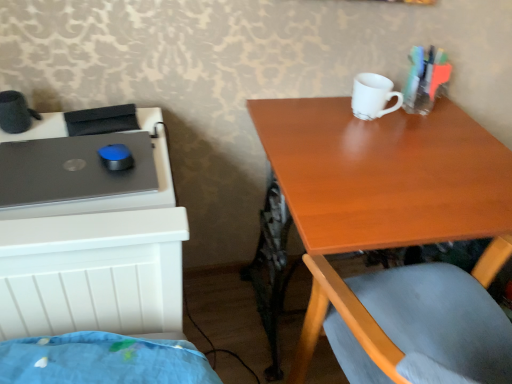
Where is `translucent plastic markers at upper right`? The height and width of the screenshot is (384, 512). translucent plastic markers at upper right is located at coordinates (425, 79).

Image resolution: width=512 pixels, height=384 pixels. What do you see at coordinates (72, 169) in the screenshot?
I see `matte black laptop at left` at bounding box center [72, 169].

What do you see at coordinates (384, 174) in the screenshot? I see `wooden table at upper right` at bounding box center [384, 174].

Identify the location of translucent plastic markers at upper right. (425, 79).

Is matte black laptop at left in contact with wooden table at upper right?

There is a gap between matte black laptop at left and wooden table at upper right.

From the image's perspective, is matte black laptop at left below wooden table at upper right?

No.

You are a GUI agent. You are given a task and a screenshot of the screen. Output one action in this format:
    pyautogui.click(x=<x>, y=<y>)
    Task: Click on the table that appears below the matte black laptop at left (from a real-world perspective)
    The height and width of the screenshot is (384, 512).
    Given the screenshot: What is the action you would take?
    pyautogui.click(x=384, y=174)

Between matte black laptop at left and wooden table at upper right, which one has less height?

matte black laptop at left is shorter.

Is wooden table at upper right closer to the viewer compared to matte black laptop at left?

No, it is not.

From a real-world perspective, is wooden table at upper right positioned over matte black laptop at left based on gravity?

Actually, wooden table at upper right is physically below matte black laptop at left in the real world.

Are wooden table at upper right and translucent plastic markers at upper right located far from each other?

No, wooden table at upper right is not far away from translucent plastic markers at upper right.

Could you tell me if wooden table at upper right is turned towards translucent plastic markers at upper right?

No, wooden table at upper right is not facing towards translucent plastic markers at upper right.

Considering the relative sizes of wooden table at upper right and translucent plastic markers at upper right in the image provided, is wooden table at upper right smaller than translucent plastic markers at upper right?

No, wooden table at upper right is not smaller than translucent plastic markers at upper right.

From a real-world perspective, who is located higher, wooden table at upper right or translucent plastic markers at upper right?

From a 3D spatial view, translucent plastic markers at upper right is above.

Is point (437, 165) positioned before point (399, 105)?

Yes.

From the picture: Considering their positions, is wooden table at upper right located in front of or behind white matte mug at upper center?

Clearly, wooden table at upper right is in front of white matte mug at upper center.

From a real-world perspective, is wooden table at upper right physically above white matte mug at upper center?

Incorrect, from a real-world perspective, wooden table at upper right is lower than white matte mug at upper center.

Which of these two, wooden table at upper right or white matte mug at upper center, stands taller?

Standing taller between the two is wooden table at upper right.

Can you tell me how much white matte mug at upper center and matte black laptop at left differ in facing direction?

There is a 93.8-degree angle between the facing directions of white matte mug at upper center and matte black laptop at left.

From a real-world perspective, is white matte mug at upper center below matte black laptop at left?

Incorrect, from a real-world perspective, white matte mug at upper center is higher than matte black laptop at left.

Measure the distance from white matte mug at upper center to matte black laptop at left.

white matte mug at upper center and matte black laptop at left are 27.87 inches apart from each other.

Considering the relative positions of white matte mug at upper center and matte black laptop at left in the image provided, is white matte mug at upper center behind matte black laptop at left?

Yes, it is.

Which object is further away from the camera taking this photo, translucent plastic markers at upper right or wooden table at upper right?

translucent plastic markers at upper right.

Who is bigger, translucent plastic markers at upper right or wooden table at upper right?

Bigger between the two is wooden table at upper right.

From a real-world perspective, is translucent plastic markers at upper right positioned above or below wooden table at upper right?

translucent plastic markers at upper right is situated higher than wooden table at upper right in the real world.

Considering the sizes of translucent plastic markers at upper right and wooden table at upper right in the image, is translucent plastic markers at upper right wider or thinner than wooden table at upper right?

Considering their sizes, translucent plastic markers at upper right looks slimmer than wooden table at upper right.

From a real-world perspective, is white matte mug at upper center over translucent plastic markers at upper right?

No.

Is the position of white matte mug at upper center more distant than that of translucent plastic markers at upper right?

That is False.

Is white matte mug at upper center positioned with its back to translucent plastic markers at upper right?

No, white matte mug at upper center is not facing away from translucent plastic markers at upper right.

Does point (368, 105) come behind point (432, 55)?

No, it is in front of (432, 55).

Locate an element on the screen. This screenshot has width=512, height=384. table that appears behind the matte black laptop at left is located at coordinates (384, 174).

Where is `laptop above the wooden table at upper right (from the image's perspective)`? laptop above the wooden table at upper right (from the image's perspective) is located at coordinates (72, 169).

From the image, which object appears to be nearer to wooden table at upper right, white matte mug at upper center or translucent plastic markers at upper right?

white matte mug at upper center is positioned closer to the anchor wooden table at upper right.

Considering their positions, is translucent plastic markers at upper right positioned closer to white matte mug at upper center than matte black laptop at left?

translucent plastic markers at upper right is positioned closer to the anchor white matte mug at upper center.

Which object lies nearer to the anchor point wooden table at upper right, white matte mug at upper center or matte black laptop at left?

white matte mug at upper center is closer to wooden table at upper right.

When comparing their distances from translucent plastic markers at upper right, does matte black laptop at left or white matte mug at upper center seem closer?

white matte mug at upper center lies closer to translucent plastic markers at upper right than the other object.

From the image, which object appears to be nearer to wooden table at upper right, matte black laptop at left or white matte mug at upper center?

white matte mug at upper center is positioned closer to the anchor wooden table at upper right.

From the image, which object appears to be farther from wooden table at upper right, translucent plastic markers at upper right or matte black laptop at left?

matte black laptop at left.

Considering their positions, is matte black laptop at left positioned closer to white matte mug at upper center than wooden table at upper right?

Among the two, wooden table at upper right is located nearer to white matte mug at upper center.

Looking at the image, which one is located further to matte black laptop at left, white matte mug at upper center or translucent plastic markers at upper right?

The object further to matte black laptop at left is translucent plastic markers at upper right.

What are the coordinates of `mug between matte black laptop at left and wooden table at upper right from left to right` in the screenshot? It's located at point(373,96).

You are a GUI agent. You are given a task and a screenshot of the screen. Output one action in this format:
    pyautogui.click(x=<x>, y=<y>)
    Task: Click on the table located between matte black laptop at left and translucent plastic markers at upper right in the left-right direction
    This screenshot has width=512, height=384.
    Given the screenshot: What is the action you would take?
    pyautogui.click(x=384, y=174)

Locate an element on the screen. This screenshot has height=384, width=512. mug between translucent plastic markers at upper right and wooden table at upper right in the up-down direction is located at coordinates (373, 96).

Locate an element on the screen. mug between matte black laptop at left and translucent plastic markers at upper right in the horizontal direction is located at coordinates (373, 96).